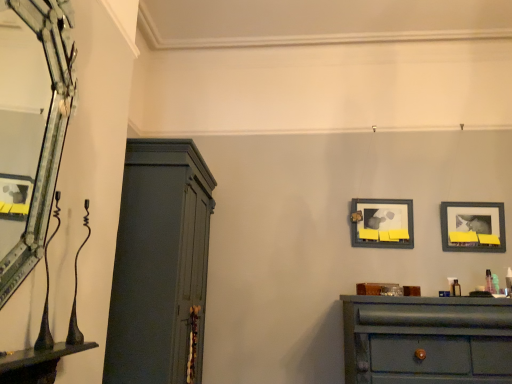
Question: Is wooden framed picture at center, which ranks as the first picture frame in left-to-right order, taller or shorter than matte black picture frame at upper right, which ranks as the first picture frame in right-to-left order?

Choices:
 (A) tall
 (B) short

Answer: (A)

Question: Is wooden framed picture at center, the second picture frame positioned from the right, bigger or smaller than matte black picture frame at upper right, which ranks as the first picture frame in right-to-left order?

Choices:
 (A) small
 (B) big

Answer: (B)

Question: Which object is the closest to the metallic silver mirror at left?

Choices:
 (A) matte gray cupboard at left
 (B) matte black picture frame at upper right, the 2th picture frame viewed from the left
 (C) wooden framed picture at center, which ranks as the first picture frame in left-to-right order
 (D) matte green dresser at lower right

Answer: (A)

Question: Estimate the real-world distances between objects in this image. Which object is closer to the matte gray cupboard at left?

Choices:
 (A) matte green dresser at lower right
 (B) wooden framed picture at center, which ranks as the first picture frame in left-to-right order
 (C) matte black picture frame at upper right, which ranks as the first picture frame in right-to-left order
 (D) metallic silver mirror at left

Answer: (A)